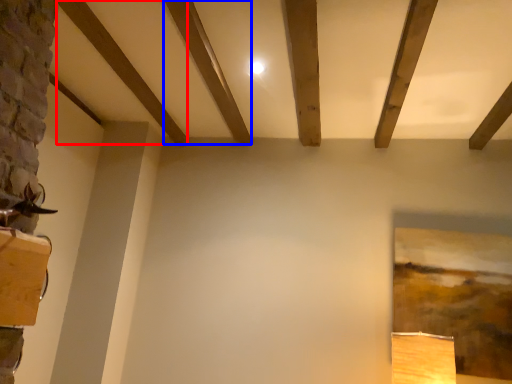
Question: Which of the following is the closest to the observer, plank (highlighted by a red box) or plank (highlighted by a blue box)?

Choices:
 (A) plank
 (B) plank

Answer: (B)